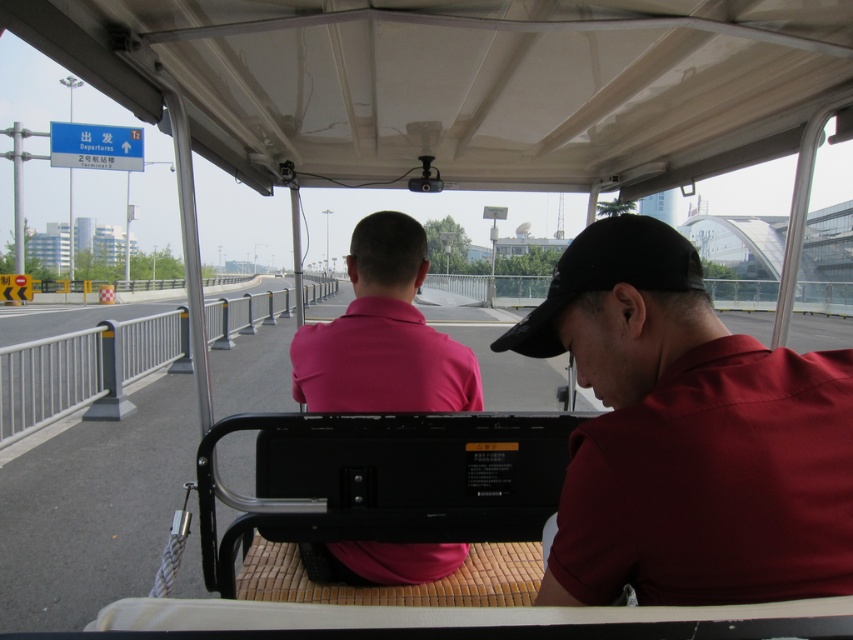
Question: Is matte red shirt at center below pink cotton shirt at center?

Choices:
 (A) no
 (B) yes

Answer: (A)

Question: Can you confirm if matte red shirt at center is positioned above pink cotton shirt at center?

Choices:
 (A) yes
 (B) no

Answer: (A)

Question: In this image, where is matte red shirt at center located relative to pink cotton shirt at center?

Choices:
 (A) above
 (B) below

Answer: (A)

Question: Which object appears farthest from the camera in this image?

Choices:
 (A) pink cotton shirt at center
 (B) matte red shirt at center

Answer: (A)